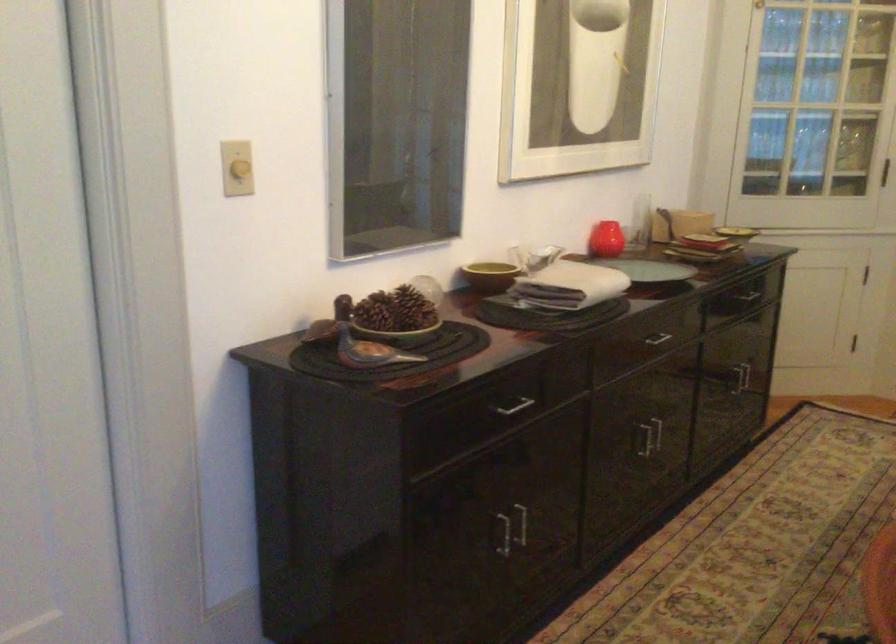
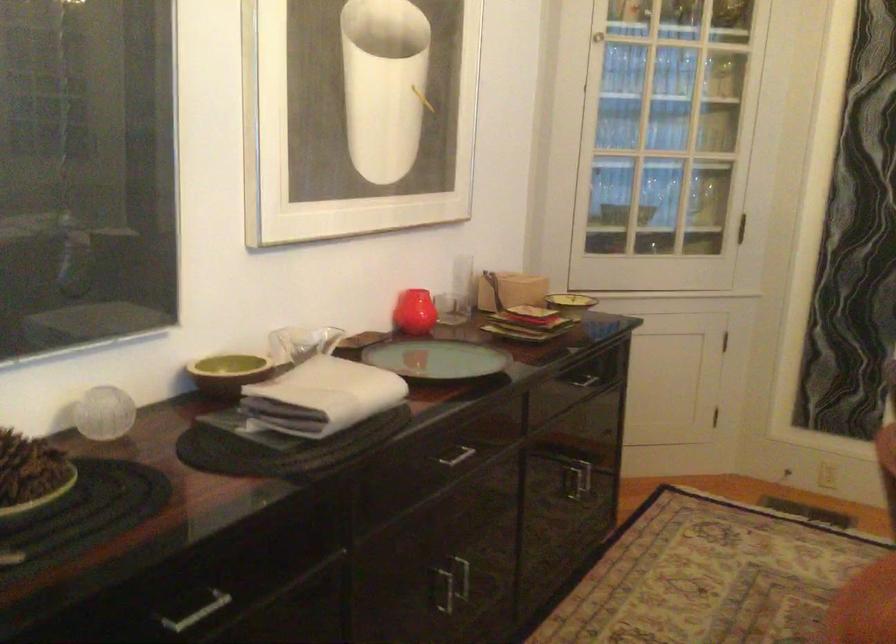
Question: The images are taken continuously from a first-person perspective. In which direction is your viewpoint rotating?

Choices:
 (A) Left
 (B) Right
 (C) Up
 (D) Down

Answer: (B)